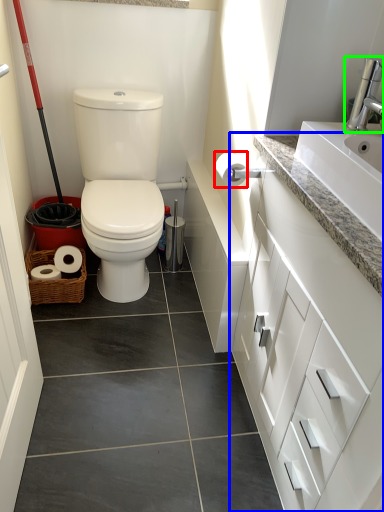
Question: Which object is positioned farthest from toilet paper (highlighted by a red box)? Select from bathroom cabinet (highlighted by a blue box) and faucet (highlighted by a green box).

Choices:
 (A) bathroom cabinet
 (B) faucet

Answer: (A)